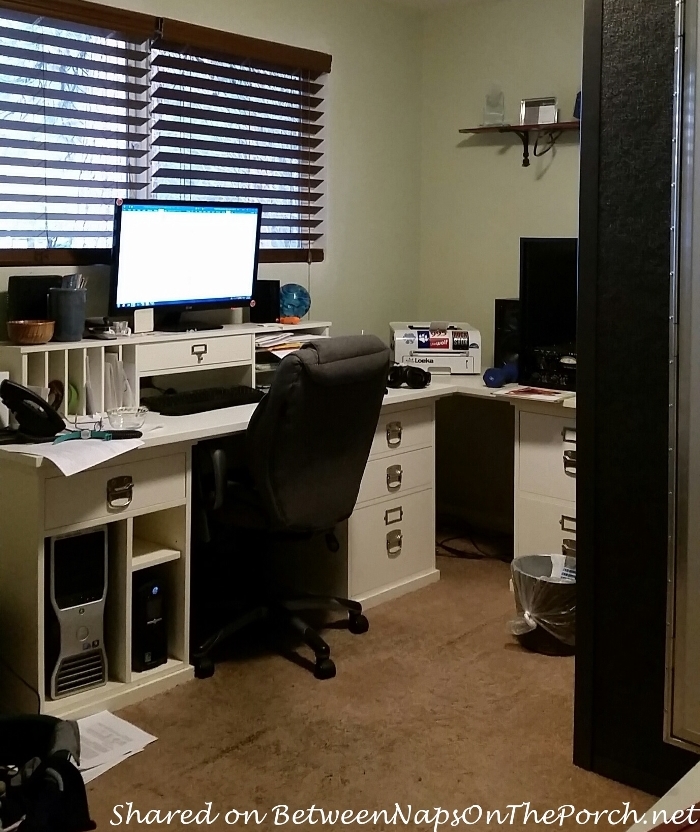
Locate an element on the screen. This screenshot has height=832, width=700. drawers is located at coordinates (418, 463), (414, 436), (420, 521), (148, 486), (530, 458), (533, 526).